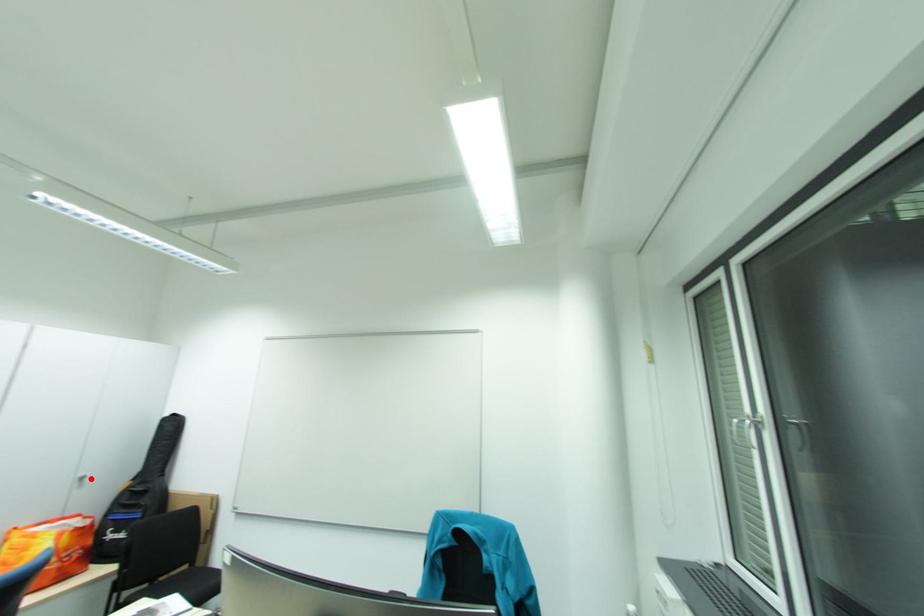
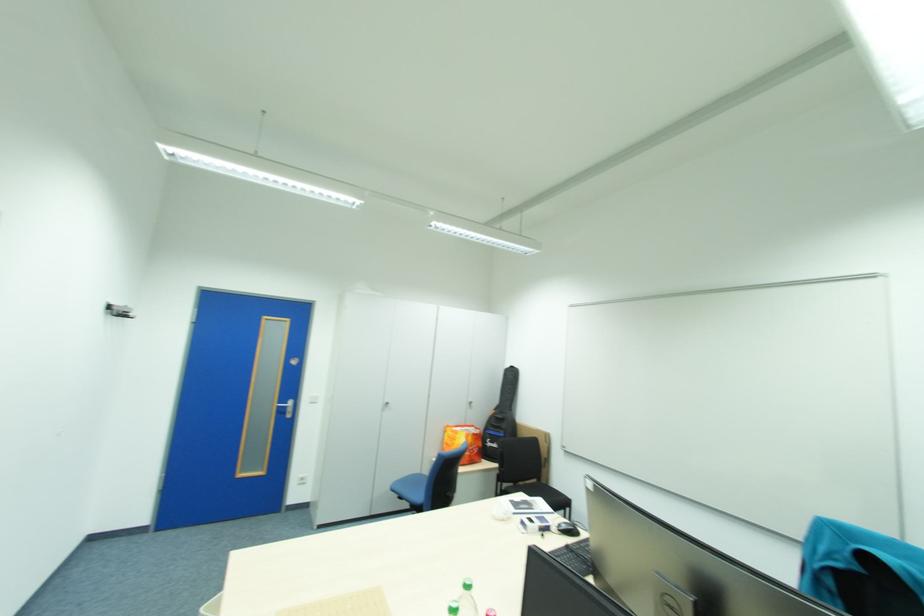
Find the pixel in the second image that matches the highlighted location in the first image.

(479, 403)